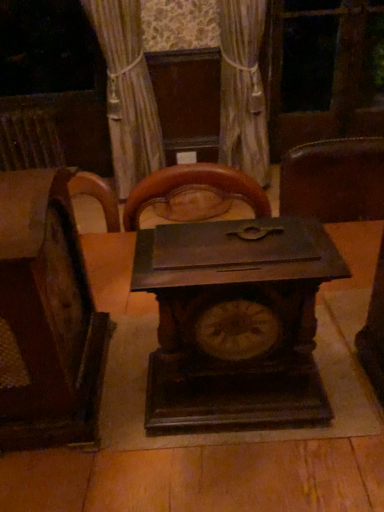
Question: Is wooden chair at left at the left side of dark wood table at center?

Choices:
 (A) yes
 (B) no

Answer: (A)

Question: Can you confirm if wooden chair at left is bigger than dark wood table at center?

Choices:
 (A) no
 (B) yes

Answer: (A)

Question: Considering the relative positions of wooden chair at left and dark wood table at center in the image provided, is wooden chair at left to the right of dark wood table at center from the viewer's perspective?

Choices:
 (A) no
 (B) yes

Answer: (A)

Question: Does wooden chair at left have a lesser height compared to dark wood table at center?

Choices:
 (A) yes
 (B) no

Answer: (A)

Question: Is wooden chair at left taller than dark wood table at center?

Choices:
 (A) yes
 (B) no

Answer: (B)

Question: Considering the relative sizes of wooden chair at left and dark wood table at center in the image provided, is wooden chair at left smaller than dark wood table at center?

Choices:
 (A) no
 (B) yes

Answer: (B)

Question: From the image's perspective, would you say rusty metal radiator at left is positioned over dark brown wood clock at center?

Choices:
 (A) no
 (B) yes

Answer: (B)

Question: Is rusty metal radiator at left outside dark brown wood clock at center?

Choices:
 (A) yes
 (B) no

Answer: (A)

Question: Is the position of rusty metal radiator at left more distant than that of dark brown wood clock at center?

Choices:
 (A) no
 (B) yes

Answer: (B)

Question: From a real-world perspective, does rusty metal radiator at left sit lower than dark brown wood clock at center?

Choices:
 (A) no
 (B) yes

Answer: (B)

Question: Considering the relative sizes of rusty metal radiator at left and dark brown wood clock at center in the image provided, is rusty metal radiator at left shorter than dark brown wood clock at center?

Choices:
 (A) yes
 (B) no

Answer: (B)

Question: Does rusty metal radiator at left have a larger size compared to dark brown wood clock at center?

Choices:
 (A) no
 (B) yes

Answer: (B)

Question: From the image's perspective, does dark wood table at center appear higher than transparent glass screen door at upper center?

Choices:
 (A) yes
 (B) no

Answer: (B)